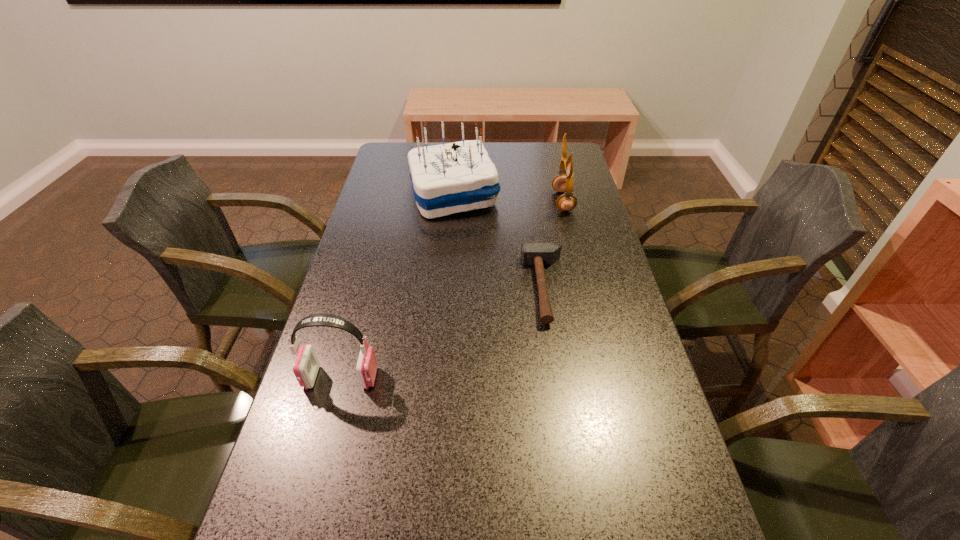
Where is `free space between the shortest object and the birthday cake`? The width and height of the screenshot is (960, 540). free space between the shortest object and the birthday cake is located at coordinates (499, 241).

Image resolution: width=960 pixels, height=540 pixels. What are the coordinates of `empty space that is in between the second nearest object and the nearest object` in the screenshot? It's located at (443, 333).

Locate an element on the screen. This screenshot has width=960, height=540. free area in between the farther earphone and the left earphone is located at coordinates (452, 289).

Image resolution: width=960 pixels, height=540 pixels. I want to click on object that is the third closest one to the birthday cake, so click(x=306, y=365).

Choose which object is the second nearest neighbor to the hammer. Please provide its 2D coordinates. Your answer should be formatted as a tuple, i.e. [(x, y)], where the tuple contains the x and y coordinates of a point satisfying the conditions above.

[(562, 183)]